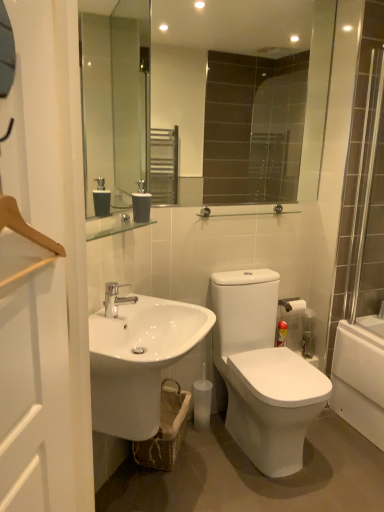
Find the location of a particular element. The height and width of the screenshot is (512, 384). vacant space in white glossy sink at lower left (from a real-world perspective) is located at coordinates (163, 490).